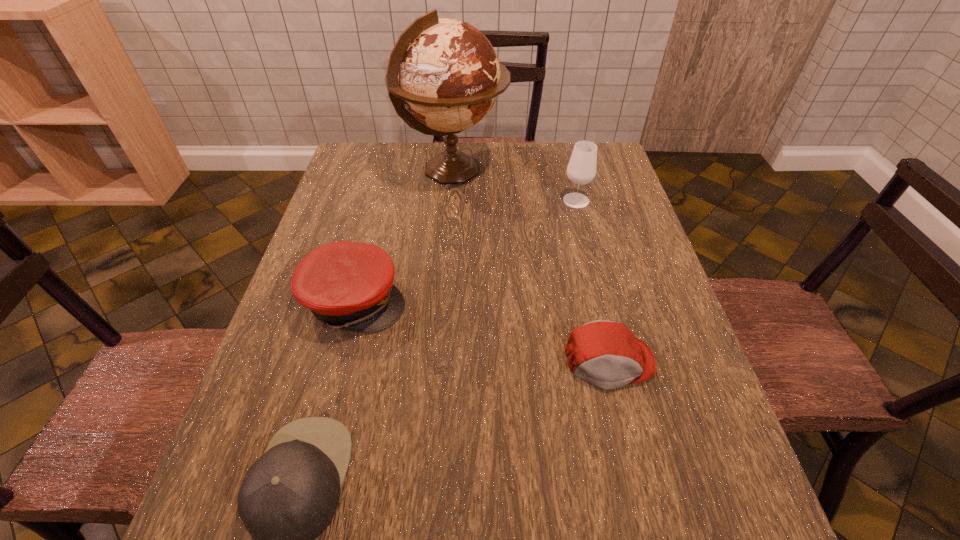
Identify which cap is the nearest to the globe. Please provide its 2D coordinates. Your answer should be formatted as a tuple, i.e. [(x, y)], where the tuple contains the x and y coordinates of a point satisfying the conditions above.

[(349, 285)]

Locate an element on the screen. Image resolution: width=960 pixels, height=540 pixels. vacant space that satisfies the following two spatial constraints: 1. on the front of the globe showing Asia; 2. on the back side of the glass is located at coordinates [x=450, y=200].

At what (x,y) coordinates should I click in order to perform the action: click on vacant point that satisfies the following two spatial constraints: 1. on the front of the glass showing Asia; 2. on the left side of the tallest object. Please return your answer as a coordinate pair (x, y). The image size is (960, 540). Looking at the image, I should click on (450, 200).